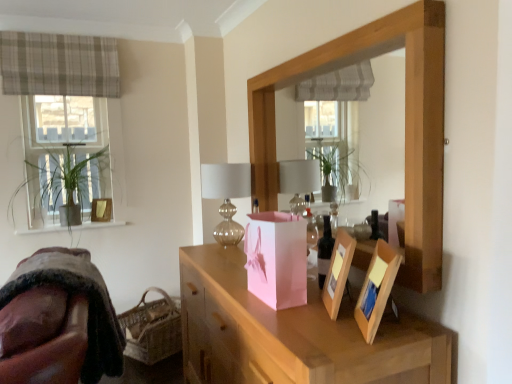
Question: From their relative heights in the image, would you say pink paper bag at center is taller or shorter than pink paper bag at center?

Choices:
 (A) short
 (B) tall

Answer: (B)

Question: Is pink paper bag at center bigger or smaller than pink paper bag at center?

Choices:
 (A) big
 (B) small

Answer: (A)

Question: Based on their relative distances, which object is farther from the green leafy plant at left?

Choices:
 (A) pink paper bag at center
 (B) translucent glass table lamp at center
 (C) pink paper bag at center
 (D) woven brown basket at lower left
 (E) dark brown glass bottle at center

Answer: (E)

Question: Which of these objects is positioned closest to the plaid fabric curtain at upper left?

Choices:
 (A) dark brown glass bottle at center
 (B) pink paper bag at center
 (C) green leafy plant at left
 (D) woven brown basket at lower left
 (E) matte gold picture frame at upper left

Answer: (C)